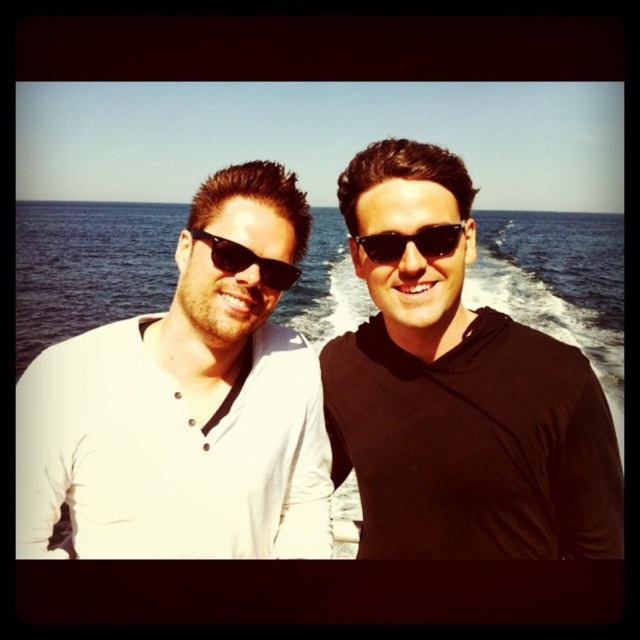
Based on the photo, between white matte shirt at left and blue water at center, which one is positioned higher?

blue water at center

Locate an element on the screen. This screenshot has height=640, width=640. white matte shirt at left is located at coordinates (188, 403).

You are a GUI agent. You are given a task and a screenshot of the screen. Output one action in this format:
    pyautogui.click(x=<x>, y=<y>)
    Task: Click on the white matte shirt at left
    The height and width of the screenshot is (640, 640).
    Given the screenshot: What is the action you would take?
    pyautogui.click(x=188, y=403)

Who is taller, white matte shirt at center or black plastic sunglasses at center?

white matte shirt at center is taller.

Who is more distant from viewer, (392, 557) or (451, 227)?

Positioned behind is point (392, 557).

I want to click on white matte shirt at center, so click(x=320, y=401).

Does blue water at center have a greater width compared to matte black sunglasses at left?

Correct, the width of blue water at center exceeds that of matte black sunglasses at left.

The image size is (640, 640). What do you see at coordinates (88, 266) in the screenshot? I see `blue water at center` at bounding box center [88, 266].

Where is `blue water at center`? The image size is (640, 640). blue water at center is located at coordinates (88, 266).

Identify the location of blue water at center. (88, 266).